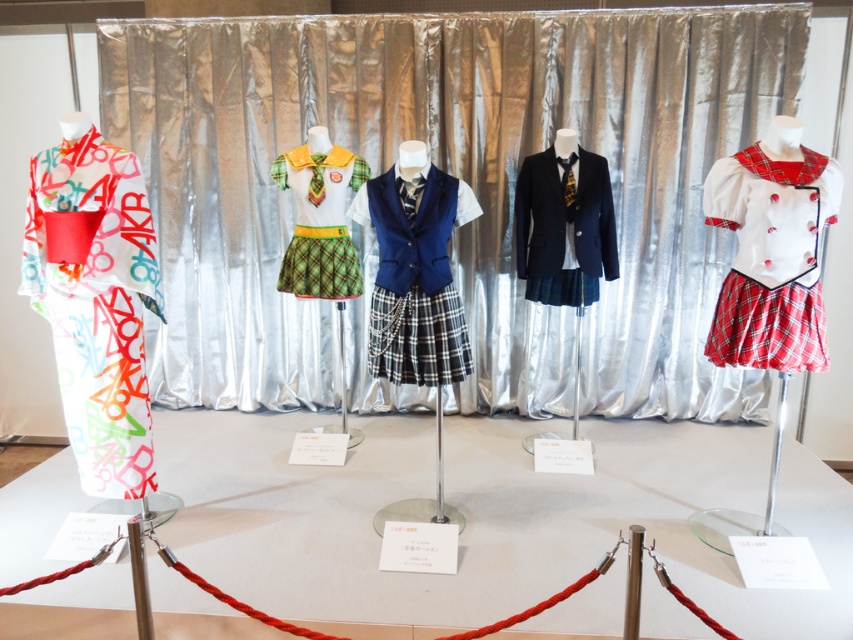
Question: Does white plaid skirt at center have a larger size compared to green plaid skirt at center?

Choices:
 (A) no
 (B) yes

Answer: (B)

Question: Which object is positioned farthest from the navy blue fabric blazer at center?

Choices:
 (A) green plaid skirt at center
 (B) white glossy table at center
 (C) navy blue fabric vest at center

Answer: (B)

Question: Does white printed kimono at left have a greater width compared to navy blue fabric blazer at center?

Choices:
 (A) no
 (B) yes

Answer: (B)

Question: Which object is closer to the camera taking this photo?

Choices:
 (A) white printed kimono at left
 (B) white plaid skirt at center

Answer: (B)

Question: Can you confirm if white glossy table at center is thinner than green plaid skirt at center?

Choices:
 (A) yes
 (B) no

Answer: (B)

Question: Which of the following is the farthest from the observer?

Choices:
 (A) white glossy table at center
 (B) navy blue fabric blazer at center
 (C) navy blue fabric vest at center

Answer: (B)